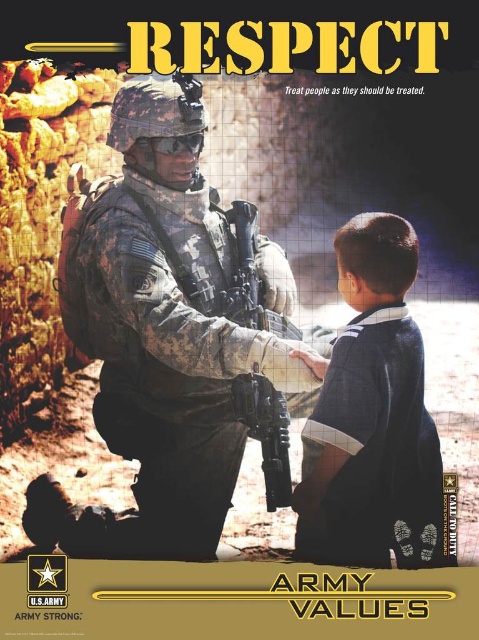
Question: Which object is closer to the camera taking this photo?

Choices:
 (A) dark blue shirt at right
 (B) camouflage uniform at center

Answer: (A)

Question: Is camouflage uniform at center wider than matte black rifle at center?

Choices:
 (A) no
 (B) yes

Answer: (B)

Question: Which object is farther from the camera taking this photo?

Choices:
 (A) camouflage uniform at center
 (B) dark blue shirt at right
 (C) matte black rifle at center

Answer: (C)

Question: Where is camouflage uniform at center located in relation to matte black rifle at center in the image?

Choices:
 (A) below
 (B) above

Answer: (A)

Question: Observing the image, what is the correct spatial positioning of dark blue shirt at right in reference to matte black rifle at center?

Choices:
 (A) above
 (B) below

Answer: (B)

Question: Which object appears farthest from the camera in this image?

Choices:
 (A) dark blue shirt at right
 (B) matte black rifle at center

Answer: (B)